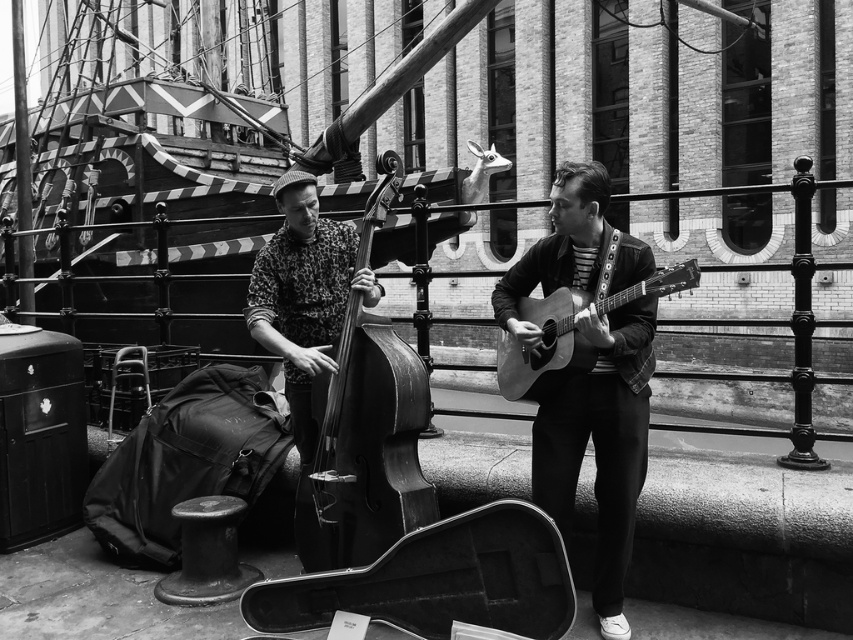
Question: Which point is farther to the camera?

Choices:
 (A) (556, 365)
 (B) (421, 397)
 (C) (306, 456)

Answer: (C)

Question: Is smooth wood guitar at center positioned before acoustic wood guitar at right?

Choices:
 (A) yes
 (B) no

Answer: (B)

Question: Is wooden polished cello at center smaller than printed fabric bass at center?

Choices:
 (A) yes
 (B) no

Answer: (B)

Question: Which point is closer to the camera?

Choices:
 (A) (621, 524)
 (B) (367, 289)
 (C) (572, 369)

Answer: (C)

Question: Does smooth wood guitar at center have a greater width compared to acoustic wood guitar at right?

Choices:
 (A) no
 (B) yes

Answer: (A)

Question: Which object is farther from the camera taking this photo?

Choices:
 (A) printed fabric bass at center
 (B) smooth wood guitar at center
 (C) acoustic wood guitar at right
 (D) wooden polished cello at center

Answer: (A)